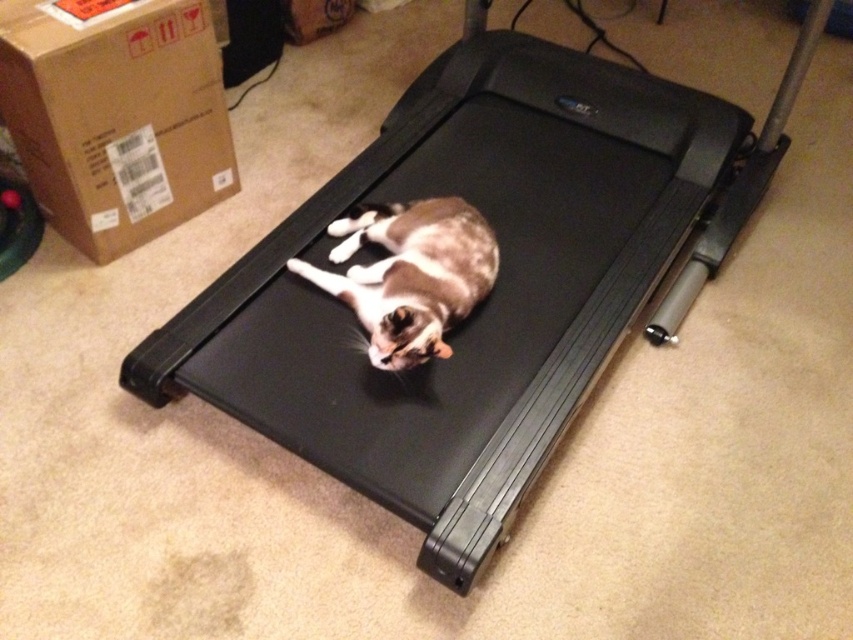
Does brown cardboard box at upper left appear over brown and white fur cat at center?

Yes, brown cardboard box at upper left is above brown and white fur cat at center.

Can you confirm if brown cardboard box at upper left is bigger than brown and white fur cat at center?

Indeed, brown cardboard box at upper left has a larger size compared to brown and white fur cat at center.

Find the location of a particular element. brown cardboard box at upper left is located at coordinates (115, 115).